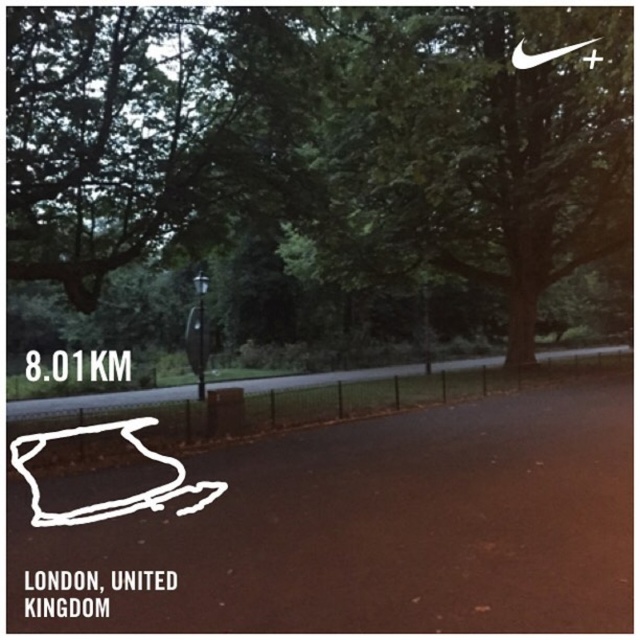
Who is higher up, green leafy tree at center or metallic pole at center?

green leafy tree at center

Who is shorter, green leafy tree at center or metallic pole at center?

Standing shorter between the two is metallic pole at center.

Who is more distant from viewer, (371, 28) or (195, 317)?

Positioned behind is point (195, 317).

Image resolution: width=640 pixels, height=640 pixels. Find the location of `green leafy tree at center`. green leafy tree at center is located at coordinates (316, 141).